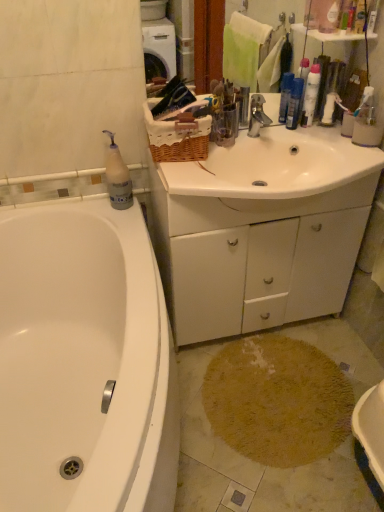
The width and height of the screenshot is (384, 512). Identify the location of vacant space in front of blue plastic spray bottle at upper right, acting as the 2th cleaning product starting from the bottom. (310, 151).